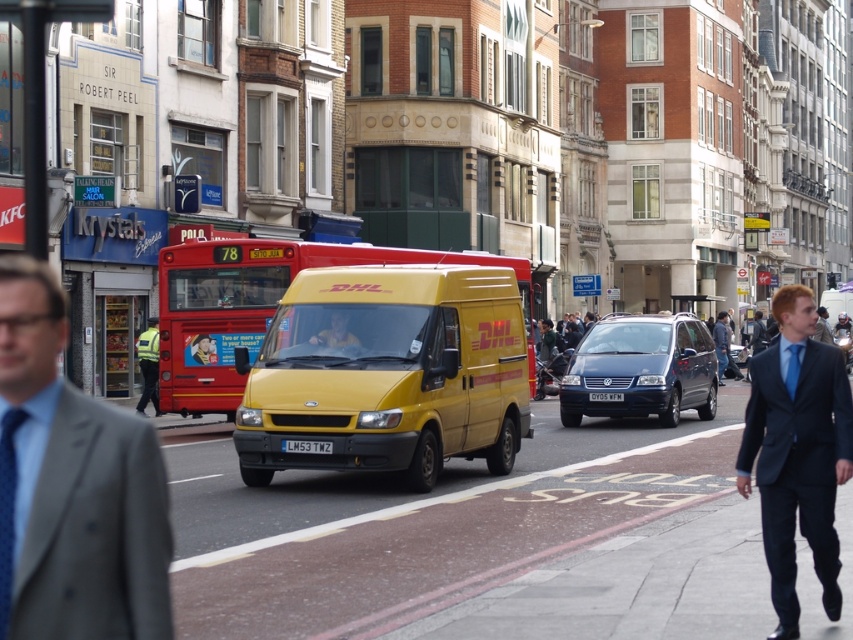
What is located at the coordinates point (7, 509)?

The blue silk tie at left is located at point (7, 509).

You are standing on the sidewalk and want to take a photo of the yellow DHL delivery van in the foreground and the red double decker bus in the background. If you move 5 meters closer to the yellow DHL delivery van, will the point marked at coordinates point (444, 420) still be visible in your photo?

The point marked at coordinates point (444, 420) is 13.18 meters from the viewer. Moving 5 meters closer would reduce the distance to 8.18 meters. Since the point is a coordinate in the scene, its visibility depends on the camera angle and field of view. However, without specific camera parameters, it is impossible to determine visibility definitively.